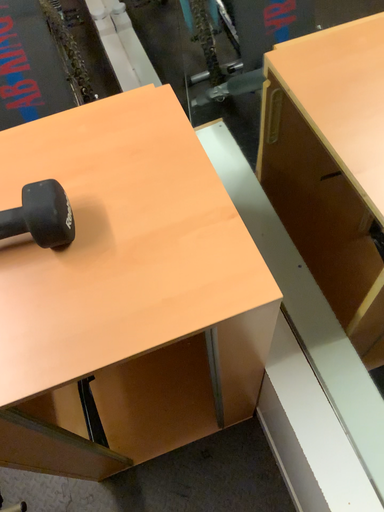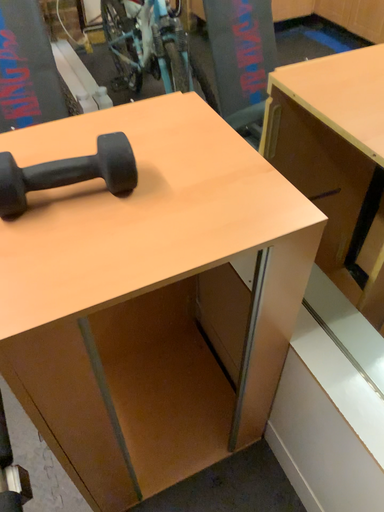
Question: How did the camera likely rotate when shooting the video?

Choices:
 (A) rotated left
 (B) rotated right

Answer: (B)